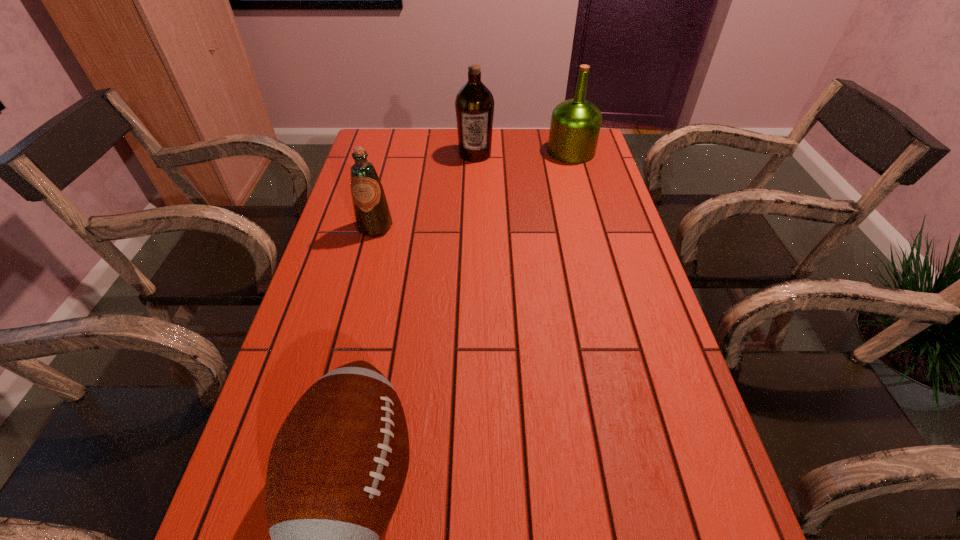
The image size is (960, 540). Find the location of `vacant space at the far edge of the desktop`. vacant space at the far edge of the desktop is located at coordinates pyautogui.click(x=444, y=141).

The width and height of the screenshot is (960, 540). What are the coordinates of `vacant space at the left edge` in the screenshot? It's located at (387, 231).

Image resolution: width=960 pixels, height=540 pixels. In the image, there is a desktop. In order to click on free space at the right edge in this screenshot , I will do `click(689, 521)`.

The height and width of the screenshot is (540, 960). In the image, there is a desktop. Identify the location of vacant space at the far left corner. (391, 140).

Image resolution: width=960 pixels, height=540 pixels. In order to click on free space at the far right corner in this screenshot , I will do `click(594, 164)`.

The height and width of the screenshot is (540, 960). Find the location of `free point between the rightmost olive oil and the shortest olive oil`. free point between the rightmost olive oil and the shortest olive oil is located at coordinates (473, 189).

Locate an element on the screen. vacant area that lies between the rightmost olive oil and the second object from right to left is located at coordinates (523, 153).

This screenshot has height=540, width=960. In order to click on vacant space in between the second olive oil from right to left and the leftmost olive oil in this screenshot , I will do click(425, 191).

Locate an element on the screen. The image size is (960, 540). unoccupied position between the leftmost olive oil and the rightmost olive oil is located at coordinates (473, 189).

This screenshot has width=960, height=540. I want to click on vacant area that lies between the rightmost object and the shortest olive oil, so click(473, 189).